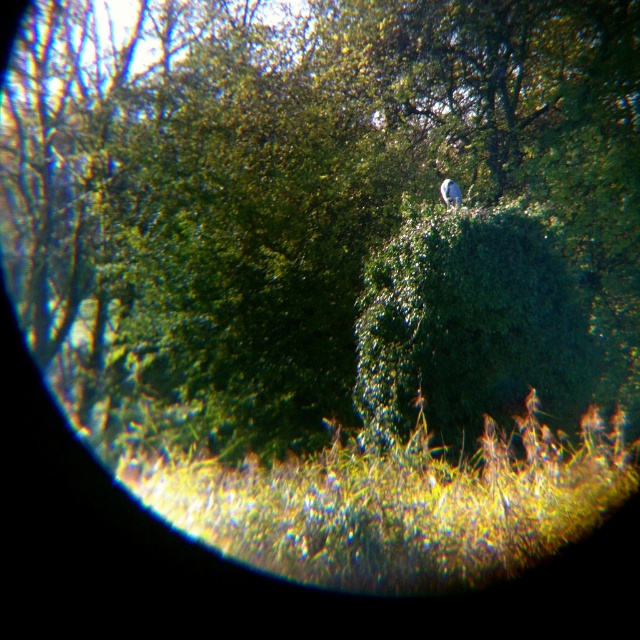
Question: Can you confirm if green leafy tree at upper center is positioned to the left of white matte bird at upper center?

Choices:
 (A) yes
 (B) no

Answer: (A)

Question: From the image, what is the correct spatial relationship of yellow-green grass at lower center in relation to green leafy hedge at center?

Choices:
 (A) above
 (B) below

Answer: (B)

Question: Does green leafy hedge at center have a smaller size compared to white matte bird at upper center?

Choices:
 (A) yes
 (B) no

Answer: (B)

Question: Estimate the real-world distances between objects in this image. Which object is farther from the white matte bird at upper center?

Choices:
 (A) green leafy tree at upper center
 (B) yellow-green grass at lower center
 (C) green leafy hedge at center

Answer: (B)

Question: Among these points, which one is farthest from the camera?

Choices:
 (A) (371, 509)
 (B) (547, 360)
 (C) (403, 172)
 (D) (452, 186)

Answer: (C)

Question: Which is farther from the yellow-green grass at lower center?

Choices:
 (A) green leafy hedge at center
 (B) white matte bird at upper center

Answer: (B)